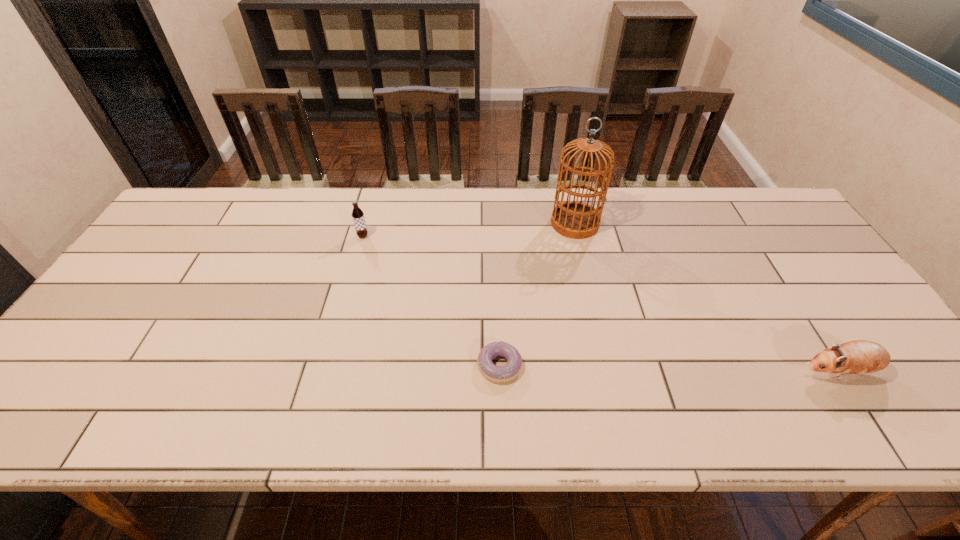
At what (x,y) coordinates should I click in order to perform the action: click on free spot located 0.360m at the face of the hamster. Please return your answer as a coordinate pair (x, y). Image resolution: width=960 pixels, height=540 pixels. Looking at the image, I should click on (639, 372).

You are a GUI agent. You are given a task and a screenshot of the screen. Output one action in this format:
    pyautogui.click(x=<x>, y=<y>)
    Task: Click on the vacant area situated 0.280m at the face of the hamster
    Image resolution: width=960 pixels, height=540 pixels.
    Given the screenshot: What is the action you would take?
    pyautogui.click(x=675, y=372)

Locate an element on the screen. The height and width of the screenshot is (540, 960). vacant point located 0.210m at the face of the hamster is located at coordinates (705, 372).

The width and height of the screenshot is (960, 540). Find the location of `vacant position located on the back of the doughnut`. vacant position located on the back of the doughnut is located at coordinates (498, 330).

Where is `birdcage located in the far edge section of the desktop`? birdcage located in the far edge section of the desktop is located at coordinates (576, 220).

The height and width of the screenshot is (540, 960). What are the coordinates of `root beer located in the far edge section of the desktop` in the screenshot? It's located at (357, 214).

Identify the location of object that is at the right edge. Image resolution: width=960 pixels, height=540 pixels. (856, 357).

Where is `free space at the far edge of the desktop`? The width and height of the screenshot is (960, 540). free space at the far edge of the desktop is located at coordinates (255, 188).

The image size is (960, 540). I want to click on vacant space at the near edge of the desktop, so click(x=203, y=397).

In the image, there is a desktop. At what (x,y) coordinates should I click in order to perform the action: click on free space at the right edge. Please return your answer as a coordinate pair (x, y). Looking at the image, I should click on (790, 273).